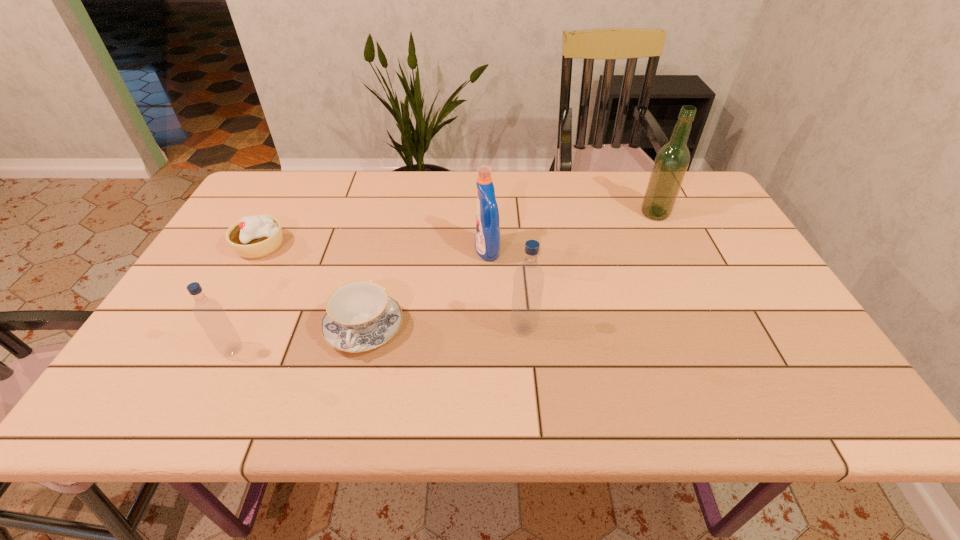
Identify the location of vacant space located on the right of the left water bottle. The width and height of the screenshot is (960, 540). (409, 351).

Image resolution: width=960 pixels, height=540 pixels. Find the location of `free spot located on the right of the second object from right to left`. free spot located on the right of the second object from right to left is located at coordinates (652, 328).

Where is `free spot located on the front of the farthest object`? This screenshot has height=540, width=960. free spot located on the front of the farthest object is located at coordinates (683, 271).

Where is `free space located 0.210m on the label of the detergent`? The width and height of the screenshot is (960, 540). free space located 0.210m on the label of the detergent is located at coordinates (397, 251).

Find the location of a particular element. This screenshot has height=540, width=960. free location located on the label of the detergent is located at coordinates (372, 251).

The image size is (960, 540). What are the coordinates of `free spot located 0.160m on the label of the detergent` in the screenshot? It's located at (417, 251).

What are the coordinates of `free space located 0.190m on the front of the whipped cream` in the screenshot? It's located at (221, 318).

I want to click on object located in the far edge section of the desktop, so click(672, 160).

Locate an element on the screen. The width and height of the screenshot is (960, 540). chinaware that is at the near edge is located at coordinates (360, 316).

Find the location of a particular element. This screenshot has width=960, height=540. object present at the left edge is located at coordinates [256, 236].